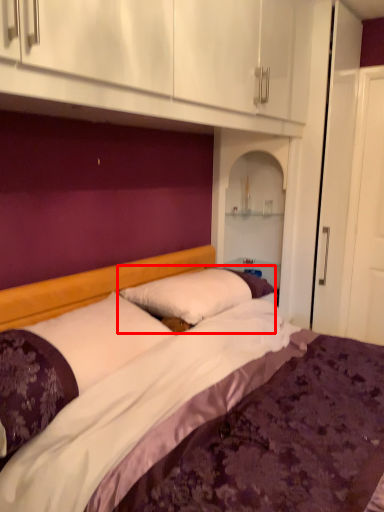
Question: From the image's perspective, what is the correct spatial positioning of pillow (annotated by the red box) in reference to pillow?

Choices:
 (A) above
 (B) below

Answer: (A)